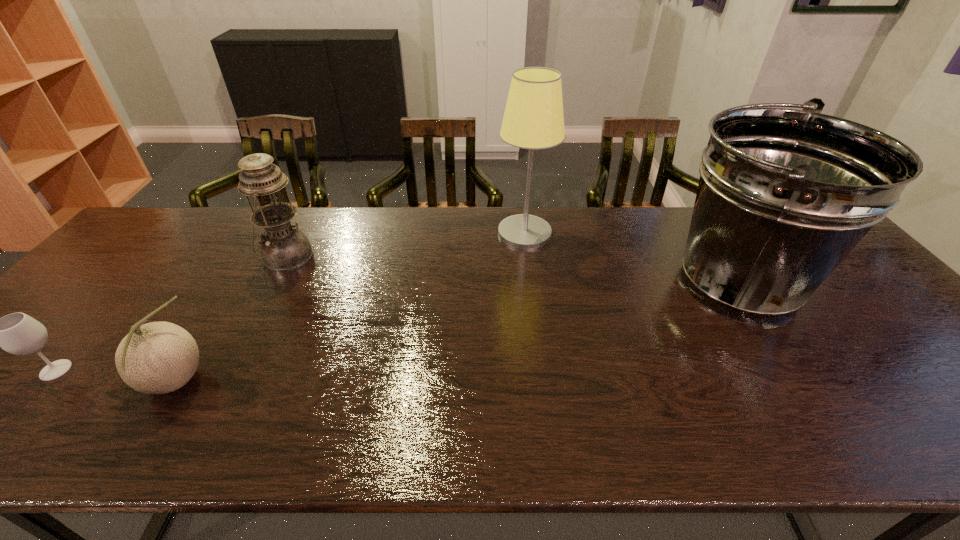
This screenshot has height=540, width=960. I want to click on blank space located on the right of the wineglass, so click(223, 370).

At what (x,y) coordinates should I click in order to perform the action: click on table lamp located at the far edge. Please return your answer as a coordinate pair (x, y). Image resolution: width=960 pixels, height=540 pixels. Looking at the image, I should click on (533, 119).

I want to click on bucket positioned at the far edge, so click(784, 195).

This screenshot has height=540, width=960. What are the coordinates of `oil lamp at the far edge` in the screenshot? It's located at (284, 248).

The height and width of the screenshot is (540, 960). I want to click on object present at the near edge, so click(x=158, y=357).

You are a GUI agent. You are given a task and a screenshot of the screen. Output one action in this format:
    pyautogui.click(x=<x>, y=<y>)
    Task: Click on the object located in the left edge section of the desktop
    The height and width of the screenshot is (540, 960).
    Given the screenshot: What is the action you would take?
    pyautogui.click(x=17, y=333)

In the image, there is a desktop. At what (x,y) coordinates should I click in order to perform the action: click on vacant space at the far edge. Please return your answer as a coordinate pair (x, y). Looking at the image, I should click on (231, 215).

The height and width of the screenshot is (540, 960). I want to click on free space at the left edge of the desktop, so click(156, 253).

Where is `free spot between the wineglass and the second shortest object`? This screenshot has height=540, width=960. free spot between the wineglass and the second shortest object is located at coordinates (115, 376).

At what (x,y) coordinates should I click in order to perform the action: click on free space between the fourth object from left to right and the cantaloup. Please return your answer as a coordinate pair (x, y). The width and height of the screenshot is (960, 540). Looking at the image, I should click on (349, 307).